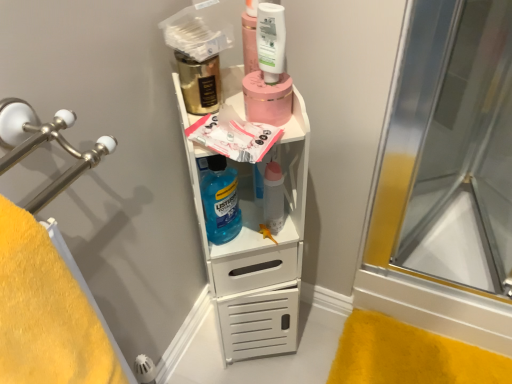
Where is `vacant area that is situated to the right of white matte cabinet at center`? This screenshot has height=384, width=512. vacant area that is situated to the right of white matte cabinet at center is located at coordinates (324, 336).